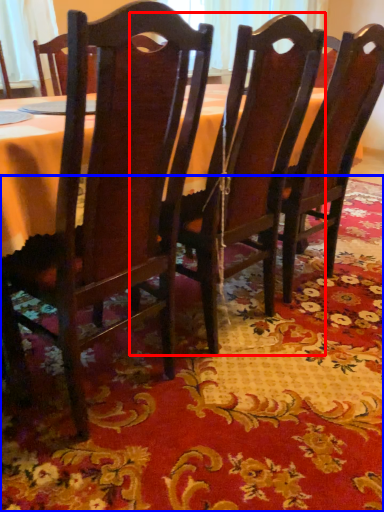
Question: Which point is further to the camera, chair (highlighted by a red box) or place mat (highlighted by a blue box)?

Choices:
 (A) chair
 (B) place mat

Answer: (A)